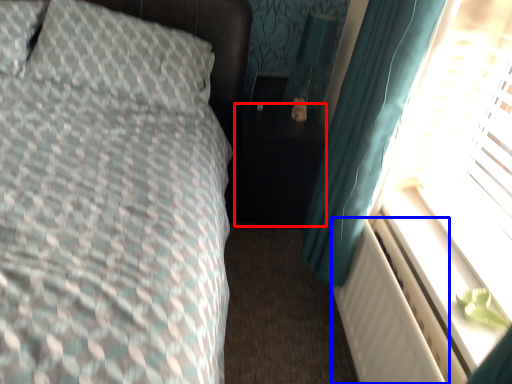
Question: Which point is further to the camera, side table (highlighted by a red box) or radiator (highlighted by a blue box)?

Choices:
 (A) side table
 (B) radiator

Answer: (A)